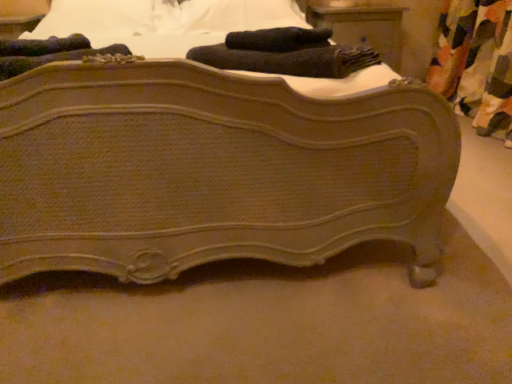
Measure the distance between matte brown wood nightstand at upper center and camera.

They are 2.46 meters apart.

The image size is (512, 384). Identify the location of matte brown wood nightstand at upper center. (364, 28).

This screenshot has height=384, width=512. What do you see at coordinates (289, 60) in the screenshot?
I see `black soft towel at upper center` at bounding box center [289, 60].

Locate an element on the screen. multicolored fabric curtain at right is located at coordinates (476, 63).

This screenshot has width=512, height=384. Find the location of `matte brown wood nightstand at upper center`. matte brown wood nightstand at upper center is located at coordinates click(x=364, y=28).

Between matte brown wood nightstand at upper center and matte brown wooden bed at center, which one has larger size?

matte brown wooden bed at center is bigger.

Is matte brown wood nightstand at upper center positioned with its back to matte brown wooden bed at center?

matte brown wood nightstand at upper center does not have its back to matte brown wooden bed at center.

Are matte brown wood nightstand at upper center and matte brown wooden bed at center located far from each other?

matte brown wood nightstand at upper center is far away from matte brown wooden bed at center.

Which object is thinner, matte brown wood nightstand at upper center or matte brown wooden bed at center?

Thinner between the two is matte brown wood nightstand at upper center.

Considering the relative sizes of matte brown wood nightstand at upper center and black soft towel at upper center in the image provided, is matte brown wood nightstand at upper center wider than black soft towel at upper center?

Correct, the width of matte brown wood nightstand at upper center exceeds that of black soft towel at upper center.

Who is shorter, matte brown wood nightstand at upper center or black soft towel at upper center?

black soft towel at upper center.

Is matte brown wood nightstand at upper center inside or outside of black soft towel at upper center?

matte brown wood nightstand at upper center is not enclosed by black soft towel at upper center.

Could matte brown wood nightstand at upper center be considered to be inside matte brown wooden bed at center?

No, matte brown wood nightstand at upper center is not surrounded by matte brown wooden bed at center.

Is the surface of matte brown wooden bed at center in direct contact with matte brown wood nightstand at upper center?

No, matte brown wooden bed at center is not with matte brown wood nightstand at upper center.

From the image's perspective, would you say matte brown wooden bed at center is shown under matte brown wood nightstand at upper center?

Yes.

Consider the image. Considering the sizes of matte brown wooden bed at center and matte brown wood nightstand at upper center in the image, is matte brown wooden bed at center bigger or smaller than matte brown wood nightstand at upper center?

Clearly, matte brown wooden bed at center is larger in size than matte brown wood nightstand at upper center.

Which object is thinner, multicolored fabric curtain at right or matte brown wood nightstand at upper center?

multicolored fabric curtain at right.

From a real-world perspective, relative to matte brown wood nightstand at upper center, is multicolored fabric curtain at right vertically above or below?

multicolored fabric curtain at right is situated lower than matte brown wood nightstand at upper center in the real world.

Image resolution: width=512 pixels, height=384 pixels. What are the coordinates of `curtain that is in front of the matte brown wood nightstand at upper center` in the screenshot? It's located at (476, 63).

Measure the distance between multicolored fabric curtain at right and matte brown wood nightstand at upper center.

multicolored fabric curtain at right and matte brown wood nightstand at upper center are 21.04 inches apart.

Between matte brown wood nightstand at upper center and multicolored fabric curtain at right, which one has less height?

With less height is matte brown wood nightstand at upper center.

Considering the positions of objects matte brown wood nightstand at upper center and multicolored fabric curtain at right in the image provided, who is in front, matte brown wood nightstand at upper center or multicolored fabric curtain at right?

multicolored fabric curtain at right is in front.

Considering the relative sizes of matte brown wood nightstand at upper center and multicolored fabric curtain at right in the image provided, is matte brown wood nightstand at upper center smaller than multicolored fabric curtain at right?

Correct, matte brown wood nightstand at upper center occupies less space than multicolored fabric curtain at right.

Considering the points (389, 45) and (492, 96), which point is behind, point (389, 45) or point (492, 96)?

The point (389, 45) is behind.

From a real-world perspective, who is located lower, matte brown wooden bed at center or multicolored fabric curtain at right?

In real-world perspective, multicolored fabric curtain at right is lower.

Between matte brown wooden bed at center and multicolored fabric curtain at right, which one appears on the left side from the viewer's perspective?

From the viewer's perspective, matte brown wooden bed at center appears more on the left side.

Between matte brown wooden bed at center and multicolored fabric curtain at right, which one is positioned behind?

multicolored fabric curtain at right is more distant.

From the image's perspective, is matte brown wooden bed at center located above or below multicolored fabric curtain at right?

Based on their image positions, matte brown wooden bed at center is located beneath multicolored fabric curtain at right.

Does point (149, 269) lie behind point (198, 58)?

No, it is not.

Is matte brown wooden bed at center oriented away from black soft towel at upper center?

No, matte brown wooden bed at center is not facing the opposite direction of black soft towel at upper center.

Is matte brown wooden bed at center bigger than black soft towel at upper center?

Indeed, matte brown wooden bed at center has a larger size compared to black soft towel at upper center.

Relative to black soft towel at upper center, is matte brown wooden bed at center in front or behind?

In the image, matte brown wooden bed at center appears in front of black soft towel at upper center.

The image size is (512, 384). Identify the location of nightstand above the matte brown wooden bed at center (from the image's perspective). (364, 28).

The image size is (512, 384). In order to click on bath towel that is on the left side of matte brown wood nightstand at upper center in this screenshot , I will do `click(289, 60)`.

Estimate the real-world distances between objects in this image. Which object is further from black soft towel at upper center, matte brown wooden bed at center or multicolored fabric curtain at right?

multicolored fabric curtain at right lies further to black soft towel at upper center than the other object.

Which object lies further to the anchor point matte brown wood nightstand at upper center, matte brown wooden bed at center or multicolored fabric curtain at right?

The object further to matte brown wood nightstand at upper center is matte brown wooden bed at center.

Estimate the real-world distances between objects in this image. Which object is further from black soft towel at upper center, multicolored fabric curtain at right or matte brown wooden bed at center?

multicolored fabric curtain at right is positioned further to the anchor black soft towel at upper center.

When comparing their distances from multicolored fabric curtain at right, does matte brown wooden bed at center or black soft towel at upper center seem further?

Among the two, matte brown wooden bed at center is located further to multicolored fabric curtain at right.

Considering their positions, is matte brown wood nightstand at upper center positioned closer to black soft towel at upper center than multicolored fabric curtain at right?

Among the two, matte brown wood nightstand at upper center is located nearer to black soft towel at upper center.

From the image, which object appears to be nearer to matte brown wooden bed at center, matte brown wood nightstand at upper center or black soft towel at upper center?

Among the two, black soft towel at upper center is located nearer to matte brown wooden bed at center.

Consider the image. Which object lies further to the anchor point matte brown wooden bed at center, black soft towel at upper center or matte brown wood nightstand at upper center?

Among the two, matte brown wood nightstand at upper center is located further to matte brown wooden bed at center.

In the scene shown: Looking at the image, which one is located further to matte brown wooden bed at center, matte brown wood nightstand at upper center or multicolored fabric curtain at right?

multicolored fabric curtain at right is further to matte brown wooden bed at center.

I want to click on curtain between black soft towel at upper center and matte brown wood nightstand at upper center in the front-back direction, so click(x=476, y=63).

This screenshot has width=512, height=384. In order to click on bath towel between matte brown wooden bed at center and matte brown wood nightstand at upper center from front to back in this screenshot , I will do `click(289, 60)`.

The width and height of the screenshot is (512, 384). Find the location of `curtain between matte brown wooden bed at center and matte brown wood nightstand at upper center in the front-back direction`. curtain between matte brown wooden bed at center and matte brown wood nightstand at upper center in the front-back direction is located at coordinates (476, 63).

Where is `bath towel located between matte brown wooden bed at center and multicolored fabric curtain at right in the left-right direction`? bath towel located between matte brown wooden bed at center and multicolored fabric curtain at right in the left-right direction is located at coordinates (289, 60).